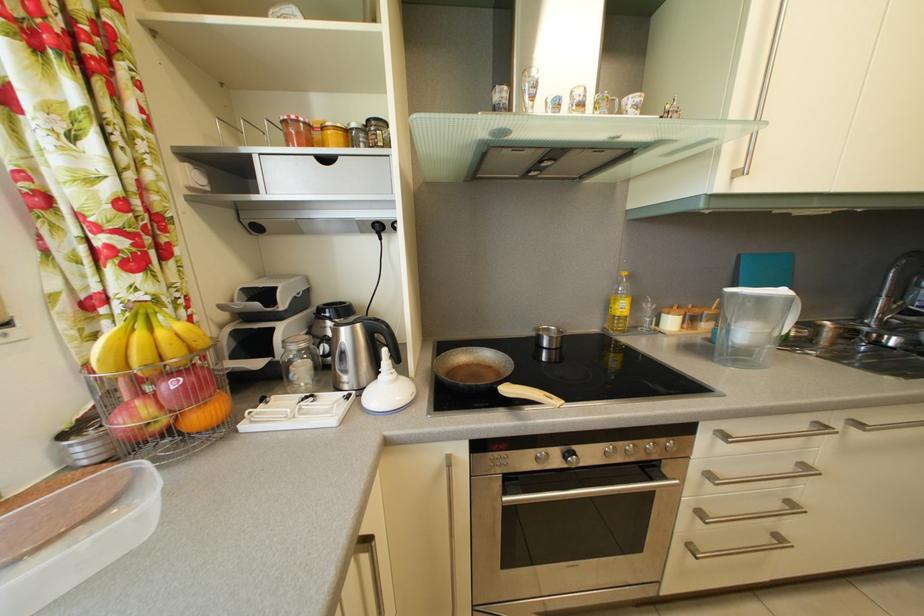
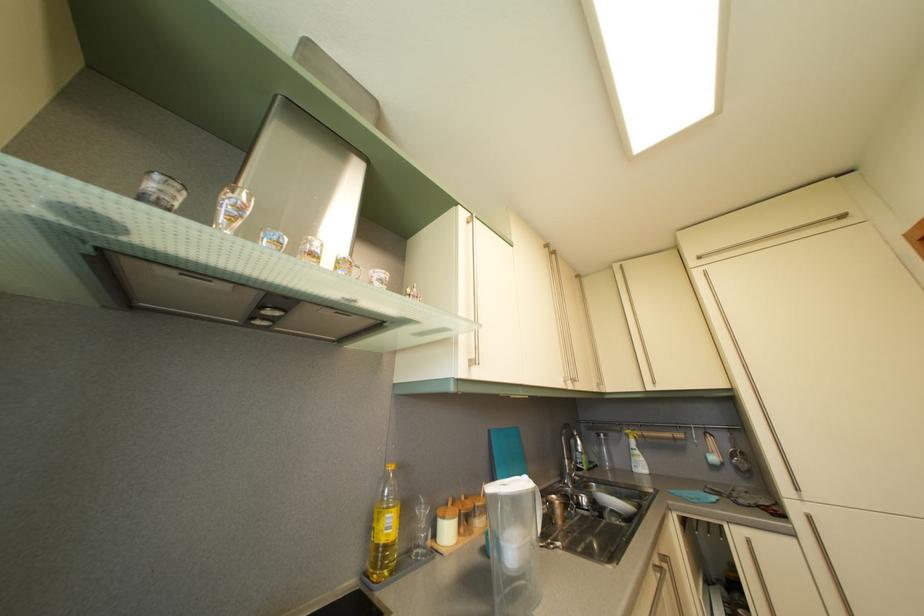
Locate, in the second image, the point that corresponds to (629,315) in the first image.

(396, 533)